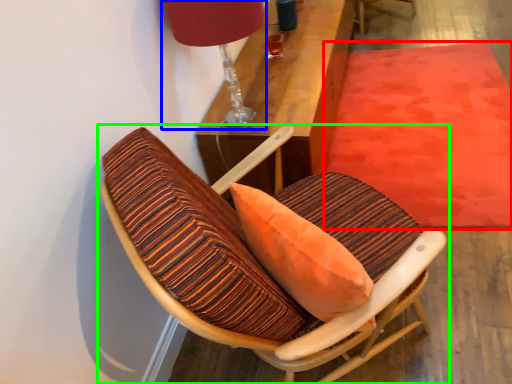
Question: Based on their relative distances, which object is farther from mat (highlighted by a red box)? Choose from table lamp (highlighted by a blue box) and chair (highlighted by a green box).

Choices:
 (A) table lamp
 (B) chair

Answer: (A)